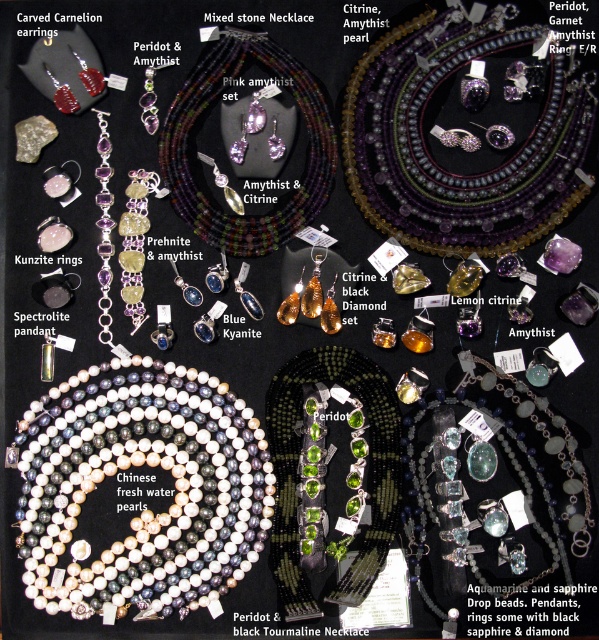
You are a customer looking at the jewelry display. You see the purple beaded necklace at upper center. Where exactly is it located in the display?

The purple beaded necklace at upper center is located at point 0.231 on the x axis and 0.760 on the y axis.

You are a customer at a jewelry store looking at the purple beaded necklace at upper center and the aquamarinesapphire drop beads at center. Which one is taller?

The purple beaded necklace at upper center is taller than the aquamarinesapphire drop beads at center.

You are a jeweler examining the jewelry display. You need to determine which of the two necklaces, the purple beaded necklace at upper center or the aquamarinesapphire drop beads at center, has a greater width. Which one is wider?

The purple beaded necklace at upper center is wider than the aquamarinesapphire drop beads at center according to the description.